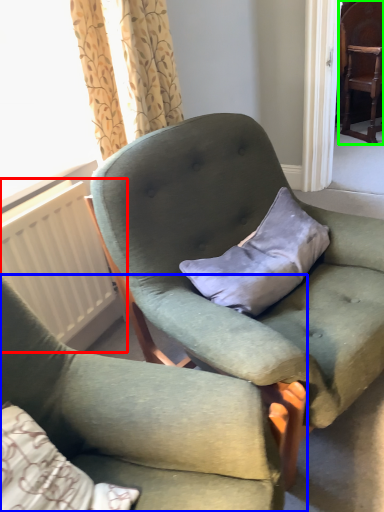
Question: Based on their relative distances, which object is nearer to radiator (highlighted by a red box)? Choose from chair (highlighted by a blue box) and chair (highlighted by a green box).

Choices:
 (A) chair
 (B) chair

Answer: (A)